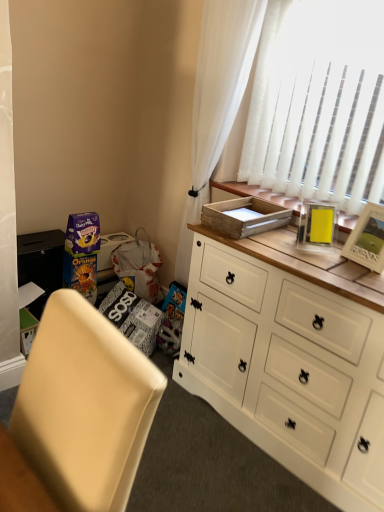
Question: Should I look upward or downward to see matte cardboard box at lower left?

Choices:
 (A) down
 (B) up

Answer: (B)

Question: Considering the relative sizes of wooden picture frame at upper right and wooden tray at upper right in the image provided, is wooden picture frame at upper right thinner than wooden tray at upper right?

Choices:
 (A) no
 (B) yes

Answer: (B)

Question: Does wooden picture frame at upper right have a smaller size compared to wooden tray at upper right?

Choices:
 (A) yes
 (B) no

Answer: (A)

Question: Is wooden picture frame at upper right not inside wooden tray at upper right?

Choices:
 (A) no
 (B) yes

Answer: (B)

Question: Does wooden picture frame at upper right have a greater height compared to wooden tray at upper right?

Choices:
 (A) no
 (B) yes

Answer: (B)

Question: From the image's perspective, is wooden picture frame at upper right located beneath wooden tray at upper right?

Choices:
 (A) yes
 (B) no

Answer: (A)

Question: Is the surface of wooden picture frame at upper right in direct contact with wooden tray at upper right?

Choices:
 (A) yes
 (B) no

Answer: (B)

Question: From the image's perspective, is white wood cabinet at center located beneath beige fabric chair at lower left?

Choices:
 (A) yes
 (B) no

Answer: (B)

Question: From a real-world perspective, is white wood cabinet at center positioned over beige fabric chair at lower left based on gravity?

Choices:
 (A) no
 (B) yes

Answer: (A)

Question: Can we say white wood cabinet at center lies outside beige fabric chair at lower left?

Choices:
 (A) no
 (B) yes

Answer: (B)

Question: Is white wood cabinet at center behind beige fabric chair at lower left?

Choices:
 (A) no
 (B) yes

Answer: (B)

Question: Is white wood cabinet at center to the left of beige fabric chair at lower left from the viewer's perspective?

Choices:
 (A) no
 (B) yes

Answer: (A)

Question: Is white wood cabinet at center in front of beige fabric chair at lower left?

Choices:
 (A) yes
 (B) no

Answer: (B)

Question: Does beige fabric chair at lower left come behind white wood cabinet at center?

Choices:
 (A) no
 (B) yes

Answer: (A)